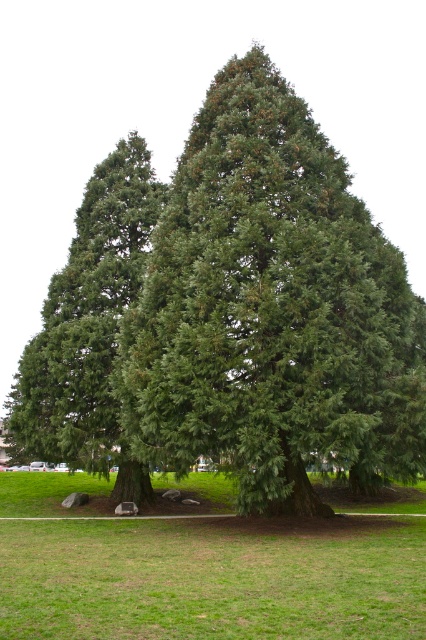
You are standing at the base of the left tree in the scene and want to walk towards the point marked at coordinate point (307,186). Will you pass by the point marked at coordinate point (385,518) on your way there?

No, because point (307,186) is in front of point (385,518), meaning it is closer to you. Therefore, you would reach point (307,186) before point (385,518) and would not pass by the latter on the way.